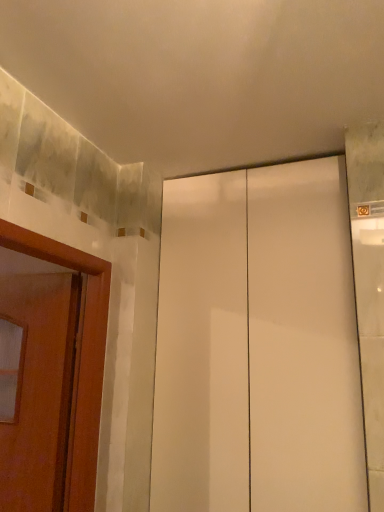
The width and height of the screenshot is (384, 512). I want to click on white glossy cabinet at center, so click(257, 345).

In order to face white glossy cabinet at center, should I rotate leftwards or rightwards?

You should look right and rotate roughly 9.214 degrees.

The height and width of the screenshot is (512, 384). What do you see at coordinates (257, 345) in the screenshot? I see `white glossy cabinet at center` at bounding box center [257, 345].

Find the location of a particular element. The image size is (384, 512). white glossy cabinet at center is located at coordinates (257, 345).